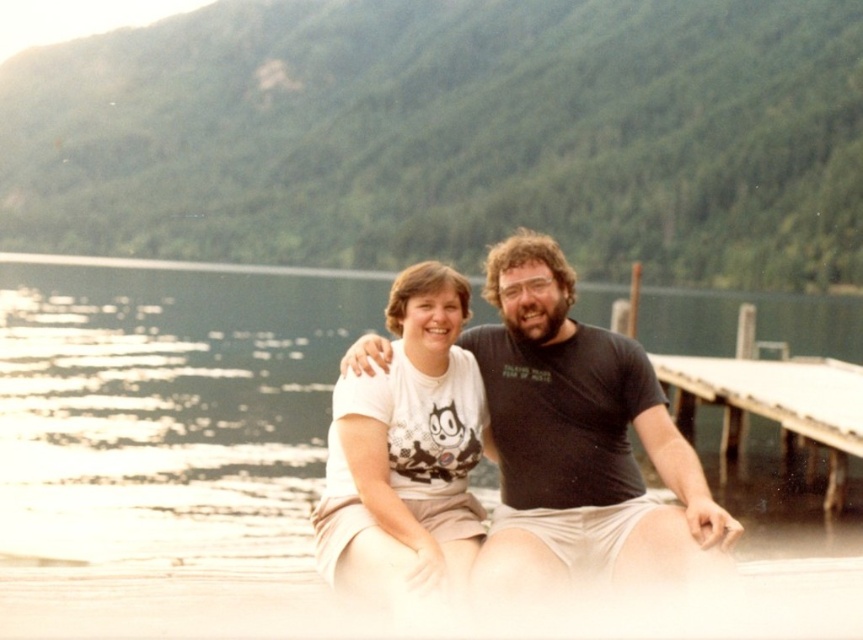
Does point (282, 561) come farther from viewer compared to point (849, 448)?

No.

Between green matte water at center and white wooden dock at right, which one is positioned lower?

white wooden dock at right is lower down.

The image size is (863, 640). Find the location of `green matte water at center`. green matte water at center is located at coordinates (167, 404).

Who is higher up, green matte water at center or black matte t-shirt at center?

green matte water at center

Does green matte water at center lie behind black matte t-shirt at center?

That is True.

Is point (168, 433) positioned after point (564, 275)?

Yes, it is behind point (564, 275).

Locate an element on the screen. The width and height of the screenshot is (863, 640). green matte water at center is located at coordinates (167, 404).

Between black matte t-shirt at center and white wooden dock at right, which one has more height?

Standing taller between the two is black matte t-shirt at center.

The width and height of the screenshot is (863, 640). What do you see at coordinates (577, 440) in the screenshot?
I see `black matte t-shirt at center` at bounding box center [577, 440].

Identify the location of black matte t-shirt at center. This screenshot has width=863, height=640. (577, 440).